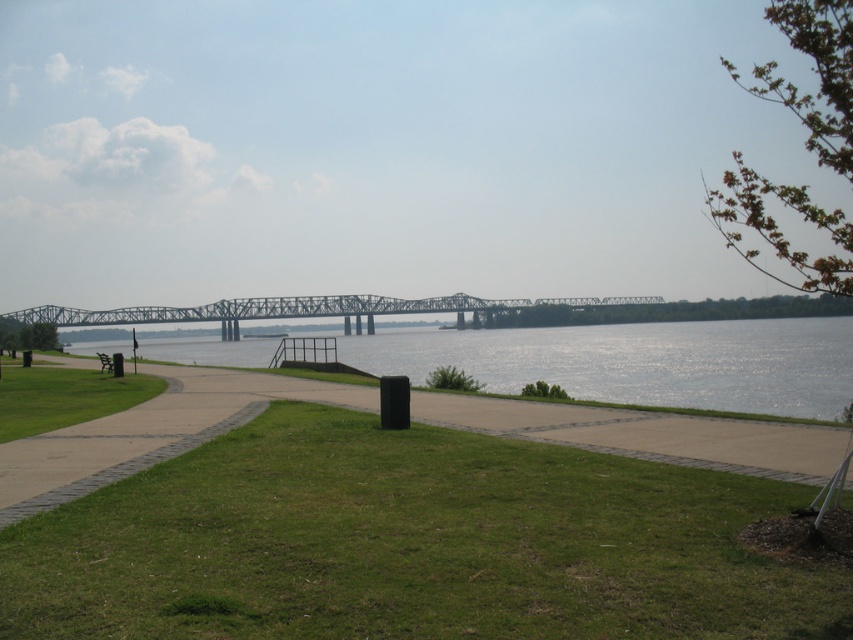
You are a visitor walking along the paved pathway and want to sit on the brown wooden park bench at lower left. Which direction should you walk to reach it without crossing the green grass at center?

The green grass at center is in front of the brown wooden park bench at lower left, so you should walk around the green grass at center to reach the bench without crossing it.

You are standing at the edge of the paved pathway and want to walk towards the green grass at center. Based on the coordinates provided, in which direction should you move relative to your current position?

The green grass at center is located at coordinates point (410, 544), so you should move towards the direction of the grassy bank along the path to reach it.

You are standing at the black trash bin near the edge of the path. You want to walk to the point marked at coordinates (640,362). Is this point located on the green water at center?

Yes, the point marked at coordinates (640,362) is on the green water at center according to the description.